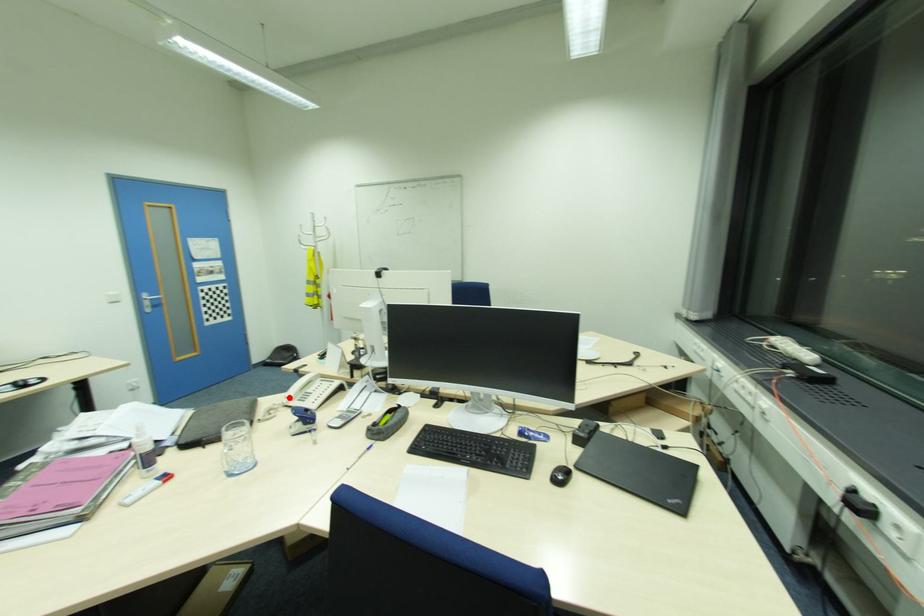
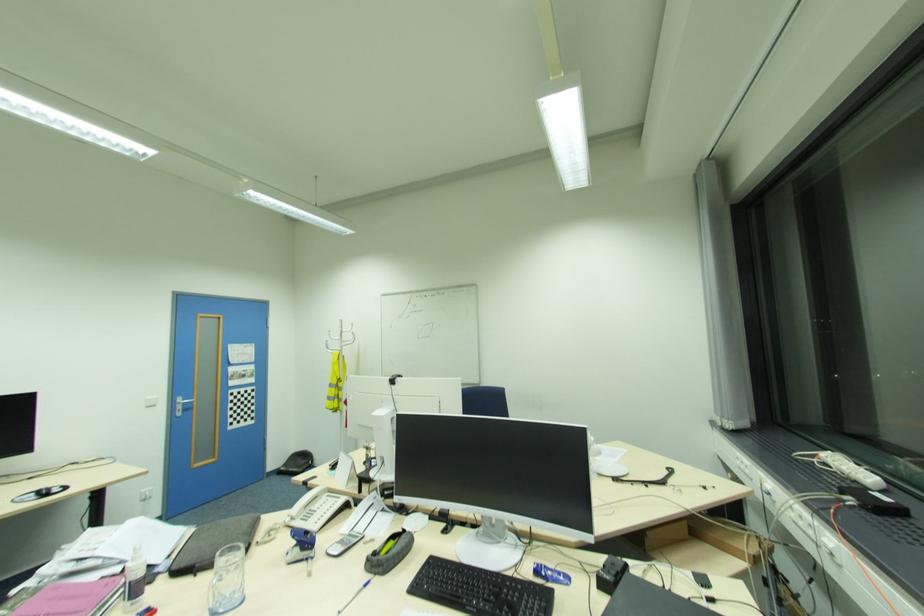
Find the pixel in the second image that matches the highlighted location in the first image.

(292, 516)